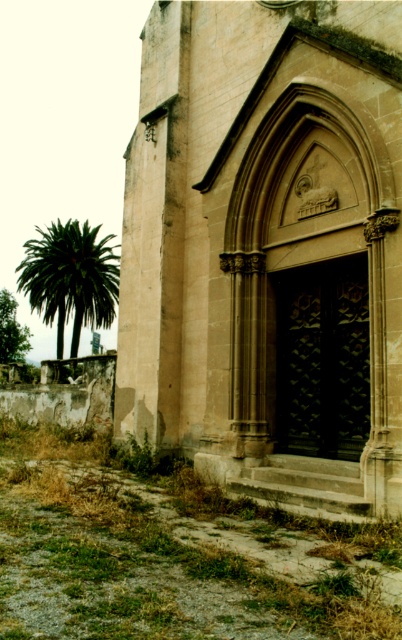
Question: Does beige stone chapel at center appear under green leafy palm at left?

Choices:
 (A) no
 (B) yes

Answer: (B)

Question: From the image, what is the correct spatial relationship of beige stone chapel at center in relation to green leafy palm at left?

Choices:
 (A) right
 (B) left

Answer: (A)

Question: Which of the following is the farthest from the observer?

Choices:
 (A) (260, 461)
 (B) (112, 320)

Answer: (B)

Question: Which object appears farthest from the camera in this image?

Choices:
 (A) green leafy palm at left
 (B) beige stone chapel at center

Answer: (A)

Question: Which object appears closest to the camera in this image?

Choices:
 (A) green leafy palm at left
 (B) beige stone chapel at center

Answer: (B)

Question: Does beige stone chapel at center appear on the left side of green leafy palm at left?

Choices:
 (A) no
 (B) yes

Answer: (A)